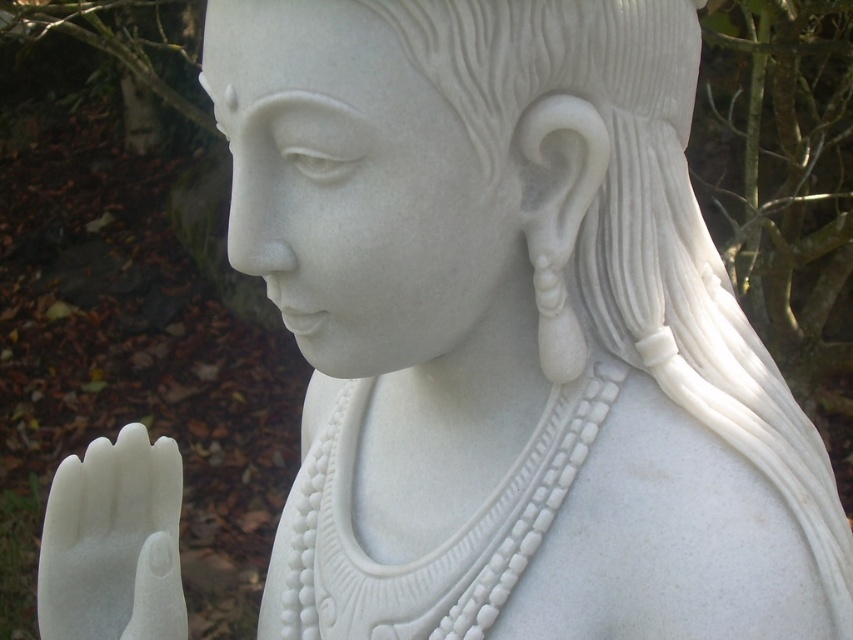
Question: Is white marble statue at center behind white marble hand at lower left?

Choices:
 (A) no
 (B) yes

Answer: (A)

Question: Can you confirm if white marble statue at center is positioned to the right of white marble hand at lower left?

Choices:
 (A) yes
 (B) no

Answer: (A)

Question: Which of the following is the closest to the observer?

Choices:
 (A) (x=178, y=637)
 (B) (x=622, y=92)

Answer: (B)

Question: From the image, what is the correct spatial relationship of white marble statue at center in relation to white marble hand at lower left?

Choices:
 (A) below
 (B) above

Answer: (B)